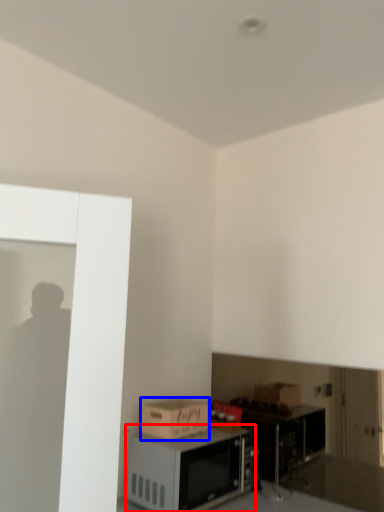
Question: Among these objects, which one is nearest to the camera, microwave (highlighted by a red box) or cardboard box (highlighted by a blue box)?

Choices:
 (A) microwave
 (B) cardboard box

Answer: (A)